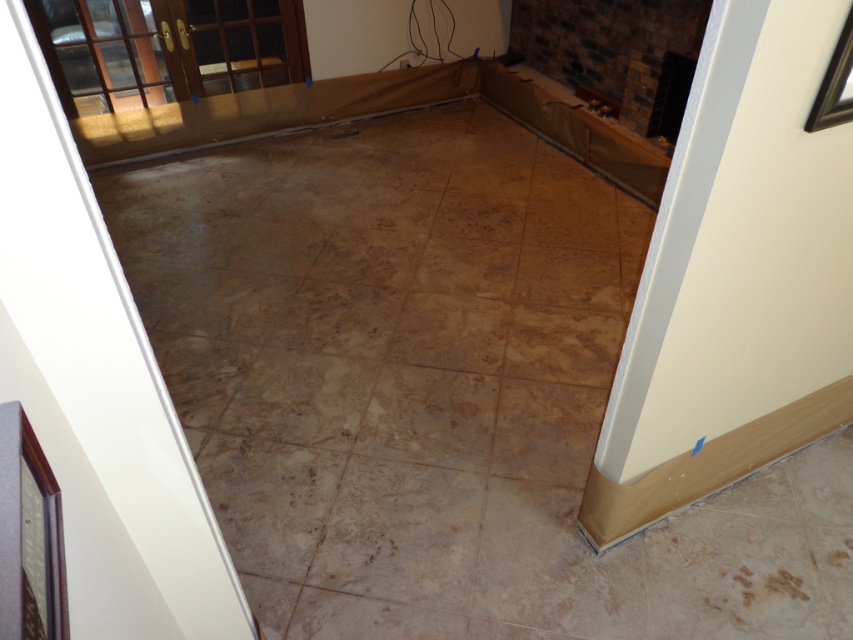
You are a contractor measuring the height of the white painted wood baseboard at lower right and the brown travertine tile at center. Which one has a greater height?

The white painted wood baseboard at lower right is taller than the brown travertine tile at center.

You are a contractor working in the room and need to install a new electrical outlet. You see the white painted wood baseboard at lower right and the brown travertine tile at center. Which object is closer to the right side of the room?

The white painted wood baseboard at lower right is closer to the right side of the room because it is positioned to the right of the brown travertine tile at center.